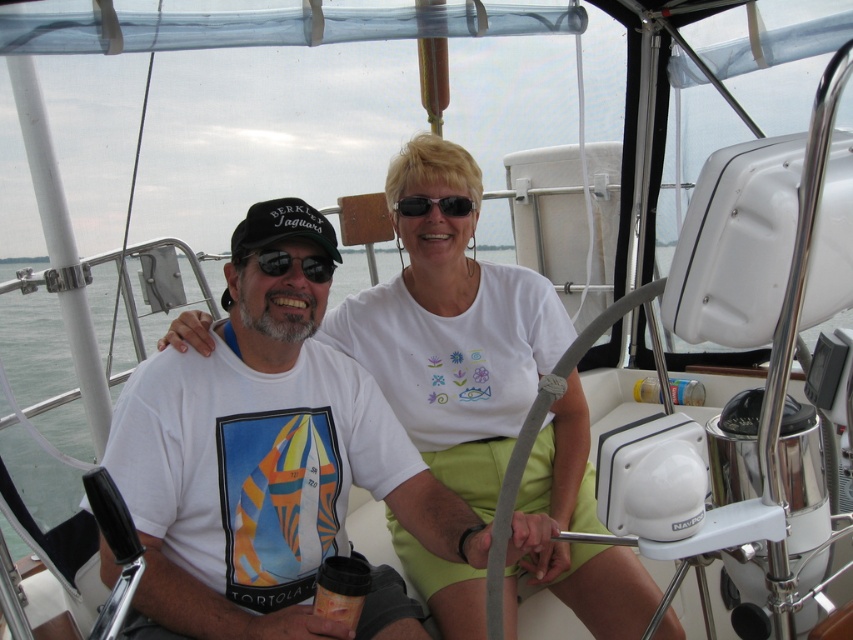
Question: Can you confirm if white matte t-shirt at center is wider than black plastic sunglasses at upper center?

Choices:
 (A) yes
 (B) no

Answer: (A)

Question: Which of the following is the closest to the observer?

Choices:
 (A) black plastic sunglasses at center
 (B) black plastic sunglasses at upper center
 (C) white matte t-shirt at center

Answer: (C)

Question: Based on their relative distances, which object is farther from the white matte t-shirt at center?

Choices:
 (A) black plastic sunglasses at center
 (B) black plastic sunglasses at upper center

Answer: (B)

Question: Which object appears closest to the camera in this image?

Choices:
 (A) white matte t-shirt at center
 (B) black plastic sunglasses at upper center

Answer: (A)

Question: Can you confirm if white matte t-shirt at center is thinner than black plastic sunglasses at upper center?

Choices:
 (A) yes
 (B) no

Answer: (B)

Question: Can you confirm if black plastic sunglasses at center is positioned below black plastic sunglasses at upper center?

Choices:
 (A) no
 (B) yes

Answer: (B)